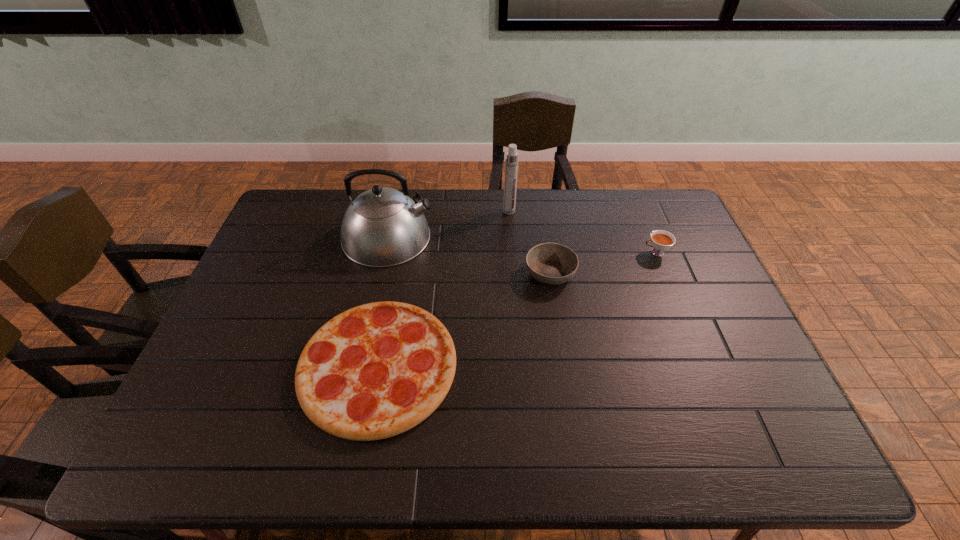
Where is `kettle`? The height and width of the screenshot is (540, 960). kettle is located at coordinates (383, 227).

At what (x,y) coordinates should I click in order to perform the action: click on the third object from right to left. Please return your answer as a coordinate pair (x, y). The image size is (960, 540). Looking at the image, I should click on (511, 162).

Image resolution: width=960 pixels, height=540 pixels. What are the coordinates of `teacup` in the screenshot? It's located at (661, 240).

Where is `the fourth object from left to right`? The image size is (960, 540). the fourth object from left to right is located at coordinates (549, 263).

Image resolution: width=960 pixels, height=540 pixels. What are the coordinates of `pizza` in the screenshot? It's located at (374, 371).

The width and height of the screenshot is (960, 540). Identify the location of the shortest object. (374, 371).

Find the location of a particular element. This screenshot has width=960, height=540. free space located 0.190m from the spout of the kettle is located at coordinates (491, 237).

Find the location of `vacant region located on the right of the aerosol can`. vacant region located on the right of the aerosol can is located at coordinates (618, 211).

You are a GUI agent. You are given a task and a screenshot of the screen. Output one action in this format:
    pyautogui.click(x=<x>, y=<y>)
    Task: Click on the free space located 0.280m on the side of the teacup with the handle
    
    Given the screenshot: What is the action you would take?
    pyautogui.click(x=556, y=253)

This screenshot has height=540, width=960. I want to click on free space located on the side of the teacup with the handle, so click(540, 253).